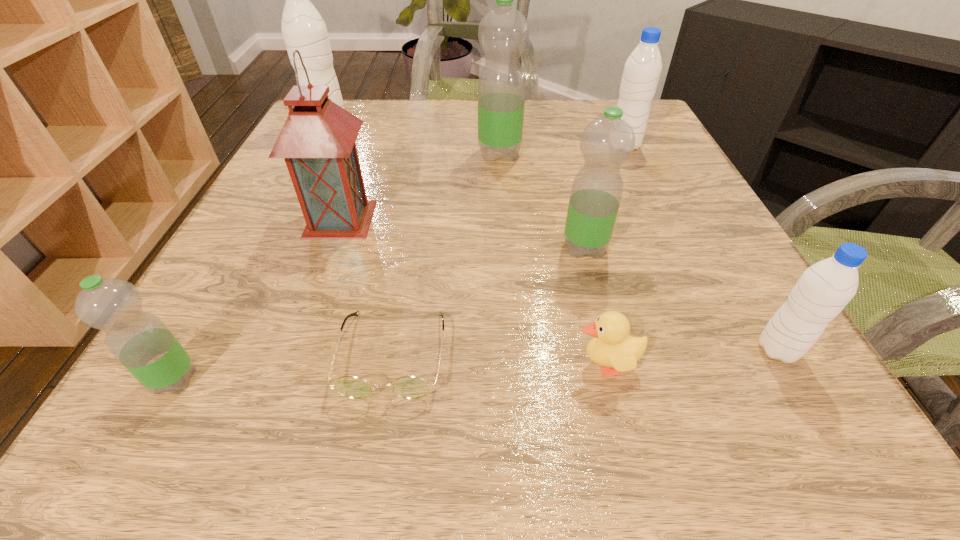
Identify the location of free space located on the back of the lantern. (356, 174).

Where is `blank area located 0.360m on the left of the second object from right to left`? blank area located 0.360m on the left of the second object from right to left is located at coordinates (447, 146).

Where is `vacant point located on the front of the second farthest green water bottle`? Image resolution: width=960 pixels, height=540 pixels. vacant point located on the front of the second farthest green water bottle is located at coordinates coord(630,425).

Identify the location of free space located 0.260m on the right of the nearest green water bottle. (400, 380).

What are the coordinates of `vacant space situated 0.240m on the left of the rightmost object` in the screenshot? It's located at (581, 349).

Where is `vacant space located 0.100m on the front-facing side of the eighth tallest object`? Image resolution: width=960 pixels, height=540 pixels. vacant space located 0.100m on the front-facing side of the eighth tallest object is located at coordinates coord(497,364).

This screenshot has height=540, width=960. I want to click on vacant space located on the front-facing side of the eighth tallest object, so click(x=346, y=364).

Image resolution: width=960 pixels, height=540 pixels. In order to click on free space located 0.080m on the front-facing side of the eighth tallest object in this screenshot , I will do `click(513, 364)`.

Image resolution: width=960 pixels, height=540 pixels. I want to click on vacant space located 0.050m on the lenses of the green spectacles, so (x=377, y=441).

You are a GUI agent. You are given a task and a screenshot of the screen. Output one action in this format:
    pyautogui.click(x=<x>, y=<y>)
    Task: Click on the water bottle located in the near edge section of the desktop
    Image resolution: width=960 pixels, height=540 pixels.
    Given the screenshot: What is the action you would take?
    pyautogui.click(x=140, y=341)